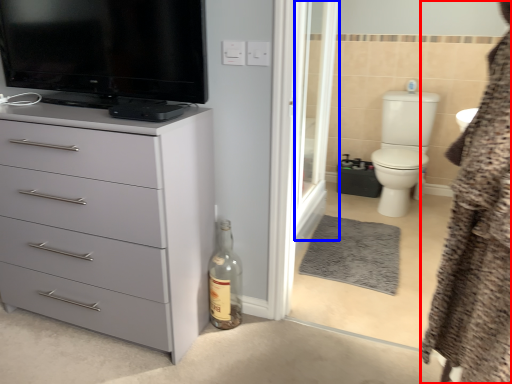
Question: Among these objects, which one is farthest to the camera, bathrobe (highlighted by a red box) or screen door (highlighted by a blue box)?

Choices:
 (A) bathrobe
 (B) screen door

Answer: (B)